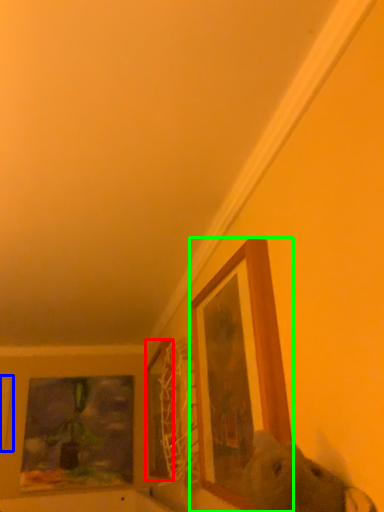
Question: Based on their relative distances, which object is nearer to picture frame (highlighted by a red box)? Choose from picture frame (highlighted by a blue box) and picture frame (highlighted by a green box).

Choices:
 (A) picture frame
 (B) picture frame

Answer: (B)